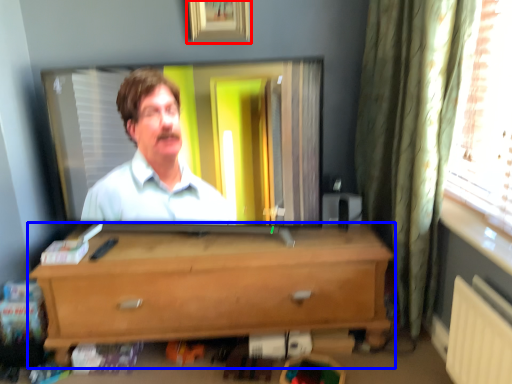
Question: Which object appears closest to the camera in this image, picture frame (highlighted by a red box) or chest of drawers (highlighted by a blue box)?

Choices:
 (A) picture frame
 (B) chest of drawers

Answer: (B)